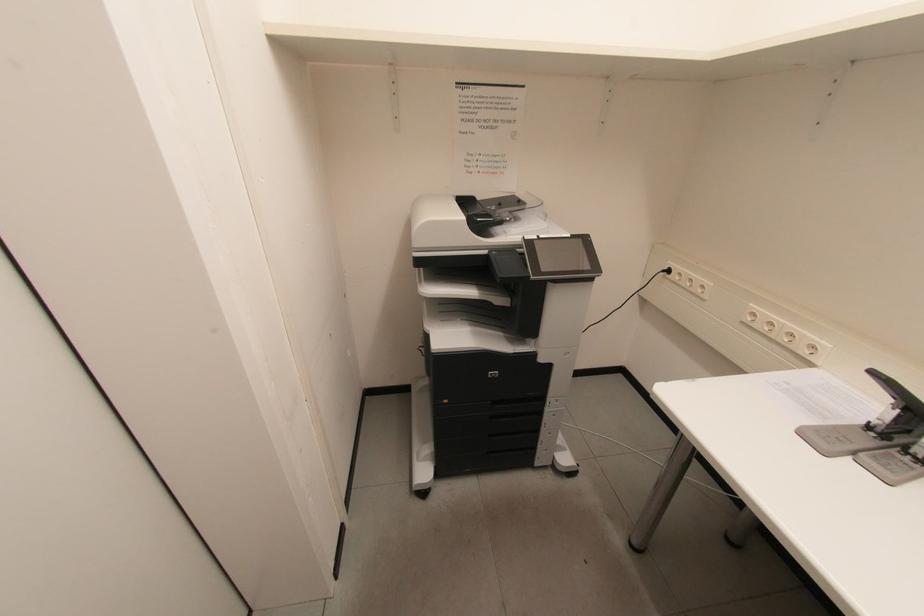
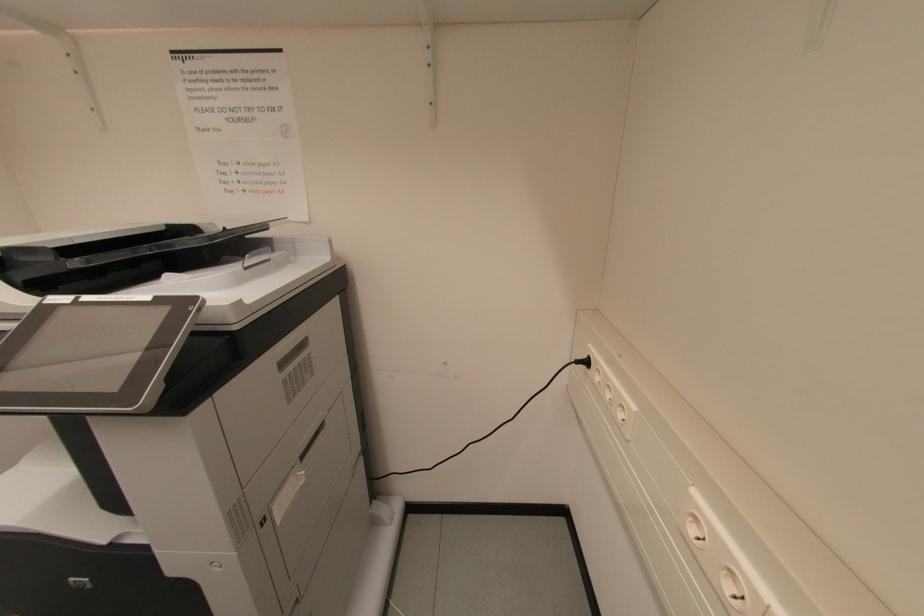
What movement of the cameraman would produce the second image?

The movement direction of the cameraman is right, forward.